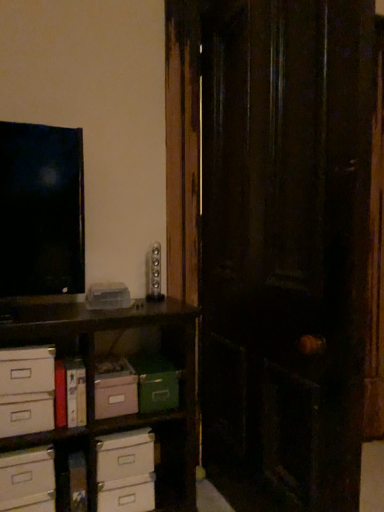
The width and height of the screenshot is (384, 512). What are the coordinates of `vacant point above white cardboard boxes at lower left (from a real-world perspective)` in the screenshot? It's located at tap(74, 307).